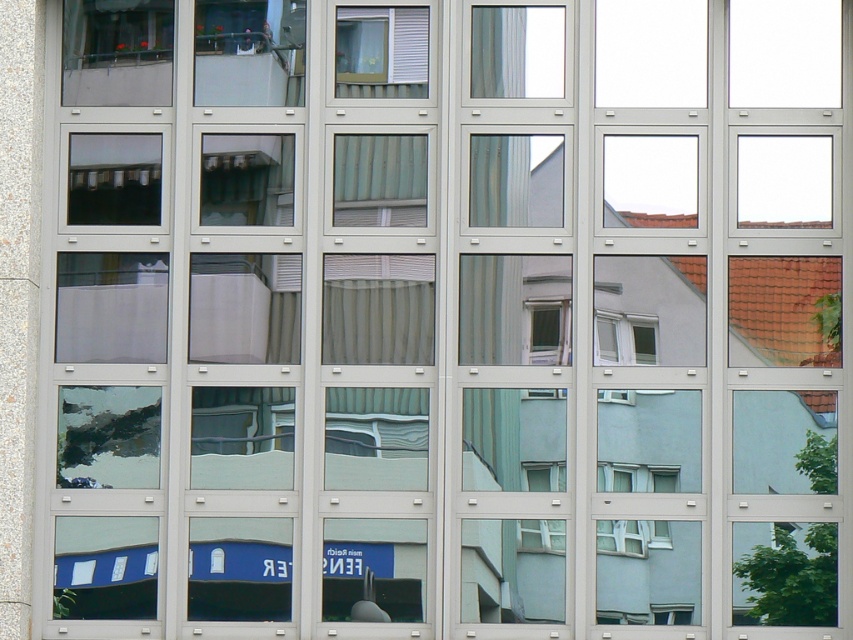
Question: Which of the following is the farthest from the observer?

Choices:
 (A) white matte blinds at upper center
 (B) white glossy window at center-right

Answer: (A)

Question: Does white matte blinds at upper center come behind white glossy window at center-right?

Choices:
 (A) yes
 (B) no

Answer: (A)

Question: In this image, where is white matte blinds at upper center located relative to white glossy window at center-right?

Choices:
 (A) left
 (B) right

Answer: (A)

Question: Does white matte blinds at upper center appear on the left side of white glossy window at center-right?

Choices:
 (A) yes
 (B) no

Answer: (A)

Question: Which point is farther from the camera taking this photo?

Choices:
 (A) (413, 61)
 (B) (636, 323)

Answer: (A)

Question: Which of the following is the closest to the observer?

Choices:
 (A) white matte blinds at upper center
 (B) white glossy window at center-right

Answer: (B)